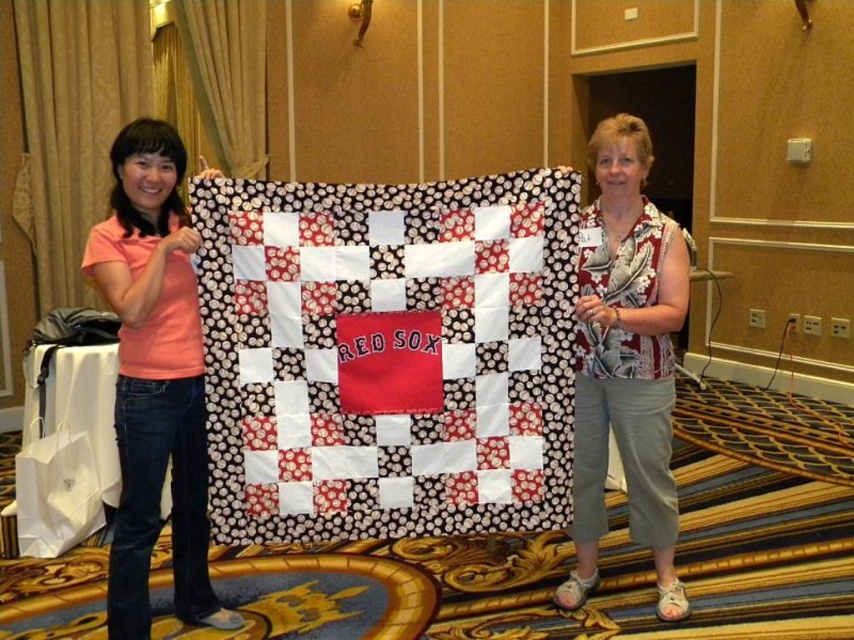
Question: Is red fabric quilt at center positioned in front of pink cotton shirt at left?

Choices:
 (A) no
 (B) yes

Answer: (A)

Question: Among these points, which one is nearest to the camera?

Choices:
 (A) (524, 182)
 (B) (176, 196)

Answer: (A)

Question: Which of these objects is positioned closest to the pink cotton shirt at left?

Choices:
 (A) printed fabric blouse at center
 (B) red fabric quilt at center

Answer: (B)

Question: Which point is closer to the camera?

Choices:
 (A) (418, 285)
 (B) (639, 426)
 (C) (117, 515)

Answer: (A)

Question: Is red fabric quilt at center behind printed fabric blouse at center?

Choices:
 (A) yes
 (B) no

Answer: (B)

Question: Is red fabric quilt at center in front of pink cotton shirt at left?

Choices:
 (A) no
 (B) yes

Answer: (A)